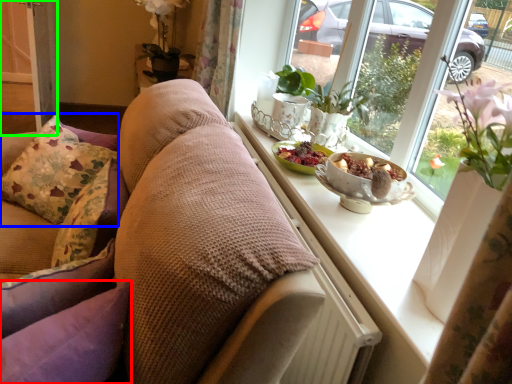
Question: Which object is positioned farthest from pillow (highlighted by a red box)? Select from pillow (highlighted by a blue box) and screen door (highlighted by a green box).

Choices:
 (A) pillow
 (B) screen door

Answer: (B)